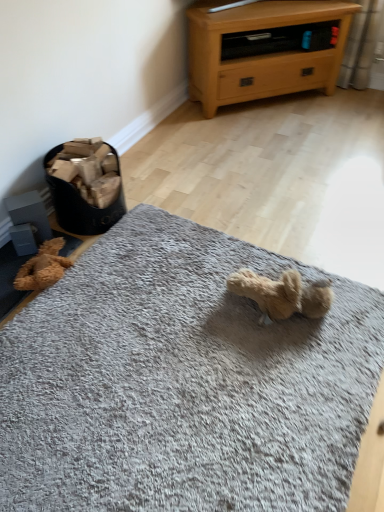
I want to click on vacant point to the right of brown plush teddy bear at lower left, so click(99, 274).